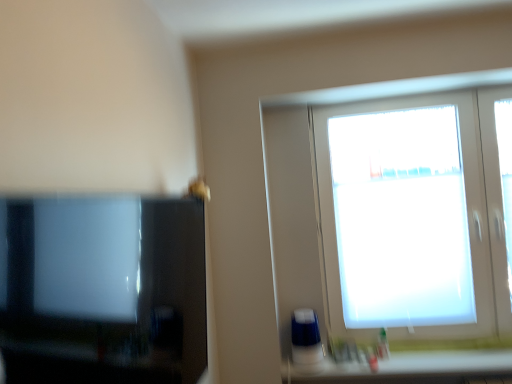
Question: From a real-world perspective, is translucent plastic bottle at lower right on white matte window at upper right?

Choices:
 (A) yes
 (B) no

Answer: (B)

Question: From a real-world perspective, is translucent plastic bottle at lower right under white matte window at upper right?

Choices:
 (A) no
 (B) yes

Answer: (B)

Question: Does translucent plastic bottle at lower right turn towards white matte window at upper right?

Choices:
 (A) yes
 (B) no

Answer: (B)

Question: Is translucent plastic bottle at lower right at the right side of white matte window at upper right?

Choices:
 (A) no
 (B) yes

Answer: (A)

Question: Could white matte window at upper right be considered to be inside translucent plastic bottle at lower right?

Choices:
 (A) no
 (B) yes

Answer: (A)

Question: Is translucent plastic bottle at lower right thinner than white matte window at upper right?

Choices:
 (A) yes
 (B) no

Answer: (A)

Question: Considering the relative positions of white plastic container at lower right and translucent plastic bottle at lower right in the image provided, is white plastic container at lower right behind translucent plastic bottle at lower right?

Choices:
 (A) no
 (B) yes

Answer: (A)

Question: Is white plastic container at lower right oriented away from translucent plastic bottle at lower right?

Choices:
 (A) yes
 (B) no

Answer: (B)

Question: From a real-world perspective, does white plastic container at lower right stand above translucent plastic bottle at lower right?

Choices:
 (A) yes
 (B) no

Answer: (B)

Question: Does white plastic container at lower right appear on the right side of translucent plastic bottle at lower right?

Choices:
 (A) no
 (B) yes

Answer: (B)

Question: Can you confirm if white plastic container at lower right is bigger than translucent plastic bottle at lower right?

Choices:
 (A) no
 (B) yes

Answer: (B)

Question: Does white plastic container at lower right have a greater width compared to translucent plastic bottle at lower right?

Choices:
 (A) yes
 (B) no

Answer: (A)

Question: Is matte black tv at left oriented away from white matte window at upper right?

Choices:
 (A) no
 (B) yes

Answer: (A)